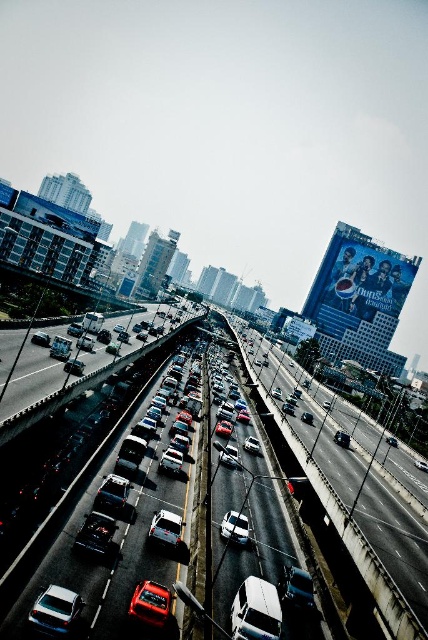
Question: Which object is positioned closest to the shiny red car at center?

Choices:
 (A) white glossy sedan at center
 (B) matte silver car at center
 (C) white glossy car at center

Answer: (A)

Question: Which object is the closest to the matte black car at center?

Choices:
 (A) shiny red car at center
 (B) white glossy car at center
 (C) matte white car at lower left

Answer: (A)

Question: Does shiny red car at center appear under metallic silver car at center?

Choices:
 (A) no
 (B) yes

Answer: (A)

Question: Is matte black car at center to the right of matte silver car at center from the viewer's perspective?

Choices:
 (A) no
 (B) yes

Answer: (B)

Question: Which of the following is the closest to the observer?

Choices:
 (A) (59, 346)
 (B) (41, 344)
 (C) (139, 609)
 (D) (261, 611)

Answer: (C)

Question: Is white glossy car at center positioned at the back of matte black car at center?

Choices:
 (A) yes
 (B) no

Answer: (B)